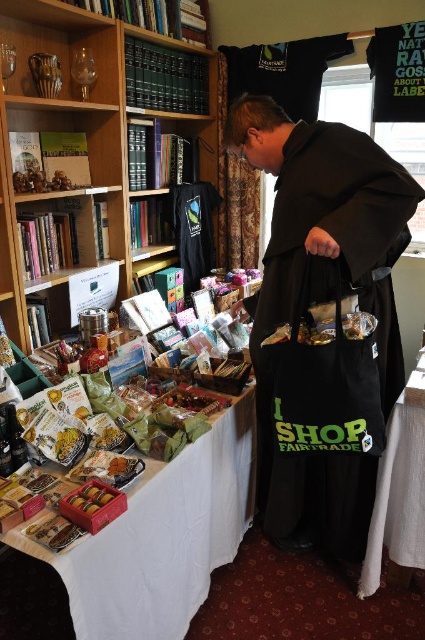
Question: Is black matte robe at center closer to the viewer compared to white fabric at lower right?

Choices:
 (A) yes
 (B) no

Answer: (A)

Question: Which point is closer to the camera?

Choices:
 (A) black matte robe at center
 (B) white fabric at lower right
 (C) white fabric table at lower left
 (D) wooden bookcase at upper left

Answer: (C)

Question: Which of the following is the closest to the observer?

Choices:
 (A) black matte robe at center
 (B) wooden bookcase at upper left
 (C) white fabric table at lower left

Answer: (C)

Question: Does white fabric table at lower left appear under white fabric at lower right?

Choices:
 (A) yes
 (B) no

Answer: (A)

Question: Which point appears farthest from the camera in this image?

Choices:
 (A) (155, 474)
 (B) (391, 428)

Answer: (B)

Question: Does black matte robe at center lie in front of white fabric table at lower left?

Choices:
 (A) no
 (B) yes

Answer: (A)